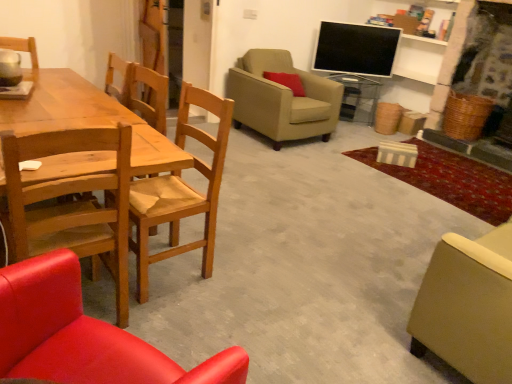
Image resolution: width=512 pixels, height=384 pixels. What are the coordinates of `vacant space underneath flat screen tv at upper right (from a real-world perspective)` in the screenshot? It's located at (348, 74).